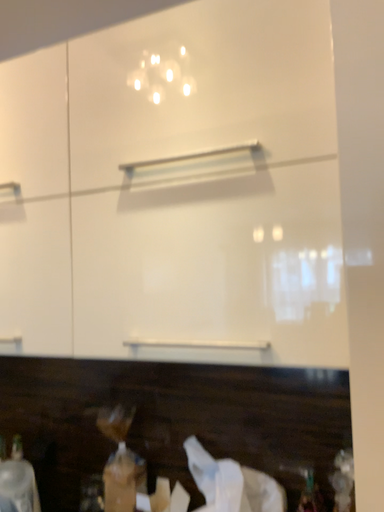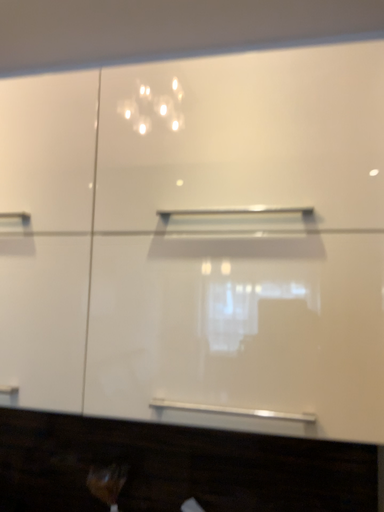
Question: How did the camera likely rotate when shooting the video?

Choices:
 (A) rotated left
 (B) rotated right

Answer: (B)